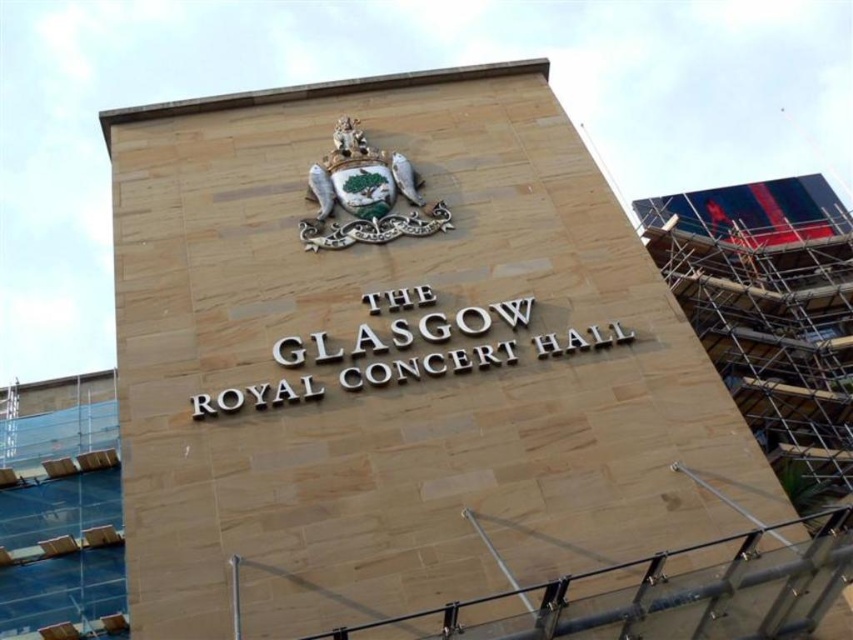
You are an architect inspecting the Glasgow Royal Concert Hall. You notice the scaffolding at right and the enamel crest at upper center. Which of these two objects appears bigger in the image?

The scaffolding at right is larger in size than the enamel crest at upper center, so the scaffolding at right appears bigger in the image.

You are standing at the entrance of The Glasgow Royal Concert Hall and want to take a photo of the emblem at the top center. The camera you have can focus on objects up to 70 meters away. Is the point at coordinates point [778,355] within the camera focus range?

The point [778,355] is 69.06 meters away from the camera, which is within the 70 meters focus range. Therefore, the camera can focus on it.

You are standing in front of the Glasgow Royal Concert Hall and want to take a photo of the emblem at the top center without any obstructions. Is there any scaffolding at right blocking your view of the emblem?

The scaffolding at right is located at point (770, 314), which is near the top right corner of the building. Since the emblem is at the top center, the scaffolding at right might be slightly to the right of the emblem, so it might not block the view of the emblem.